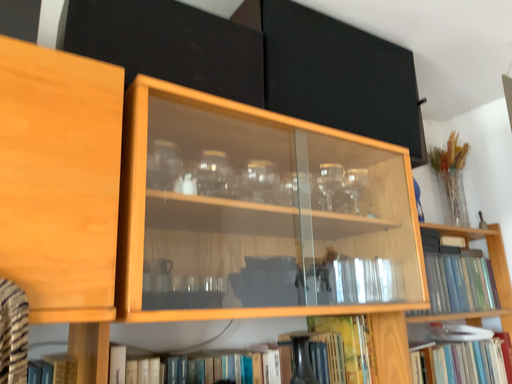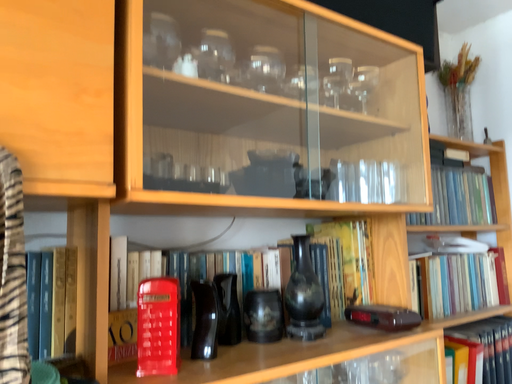
Question: How did the camera likely rotate when shooting the video?

Choices:
 (A) rotated upward
 (B) rotated downward

Answer: (B)